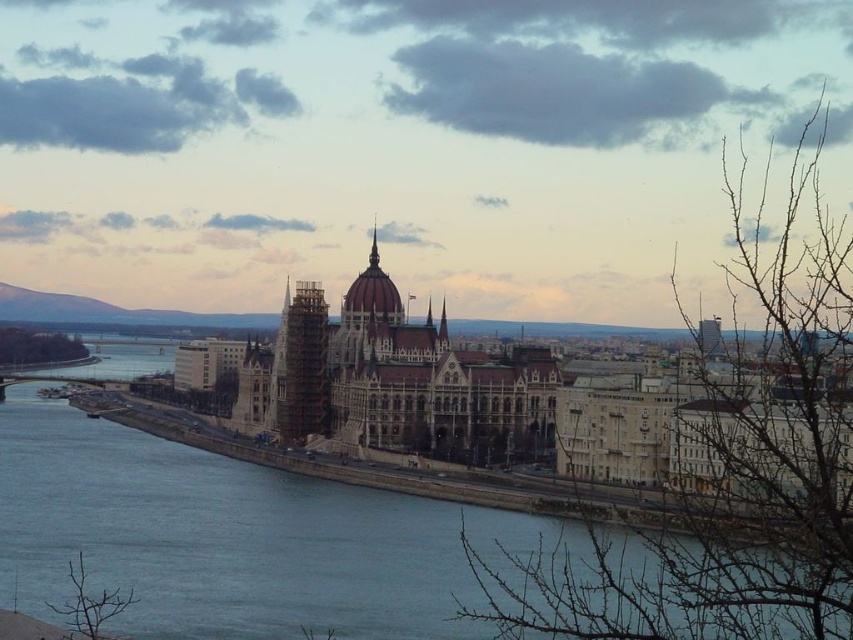
Question: Estimate the real-world distances between objects in this image. Which object is farther from the blue water at center?

Choices:
 (A) wooden scaffolding at center
 (B) stone gothic palace at center

Answer: (A)

Question: Is blue water at center bigger than wooden scaffolding at center?

Choices:
 (A) yes
 (B) no

Answer: (A)

Question: Does blue water at center have a smaller size compared to wooden scaffolding at center?

Choices:
 (A) no
 (B) yes

Answer: (A)

Question: Does blue water at center have a greater width compared to wooden scaffolding at center?

Choices:
 (A) no
 (B) yes

Answer: (B)

Question: Which point appears closest to the camera in this image?

Choices:
 (A) (277, 390)
 (B) (682, 380)

Answer: (B)

Question: Which point is farther from the camera taking this photo?

Choices:
 (A) click(335, 628)
 (B) click(300, 298)
 (C) click(404, 442)

Answer: (B)